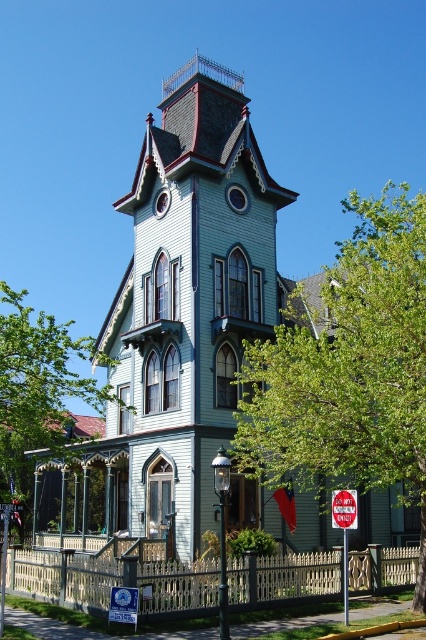
Question: Is green leafy tree at lower right positioned before red metal stop sign at center?

Choices:
 (A) yes
 (B) no

Answer: (A)

Question: Is green leafy tree at lower right to the left of red metal stop sign at center from the viewer's perspective?

Choices:
 (A) no
 (B) yes

Answer: (A)

Question: Which object is positioned farthest from the red metal stop sign at center?

Choices:
 (A) green leafy tree at lower right
 (B) green leafy tree at center

Answer: (B)

Question: Where is green leafy tree at center located in relation to red metal stop sign at center in the image?

Choices:
 (A) right
 (B) left

Answer: (B)

Question: Among these points, which one is nearest to the camera?

Choices:
 (A) (276, 328)
 (B) (49, 339)
 (C) (345, 529)

Answer: (C)

Question: Which point appears closest to the camera in this image?

Choices:
 (A) coord(2,296)
 (B) coord(351,520)
 (C) coord(359,476)

Answer: (B)